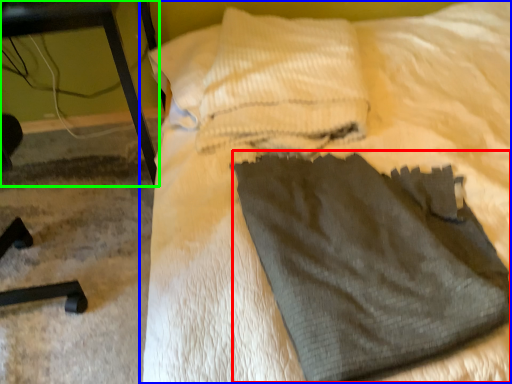
Question: Which object is the closest to the sweat pant (highlighted by a red box)? Choose among these: bed (highlighted by a blue box) or furniture (highlighted by a green box).

Choices:
 (A) bed
 (B) furniture

Answer: (A)